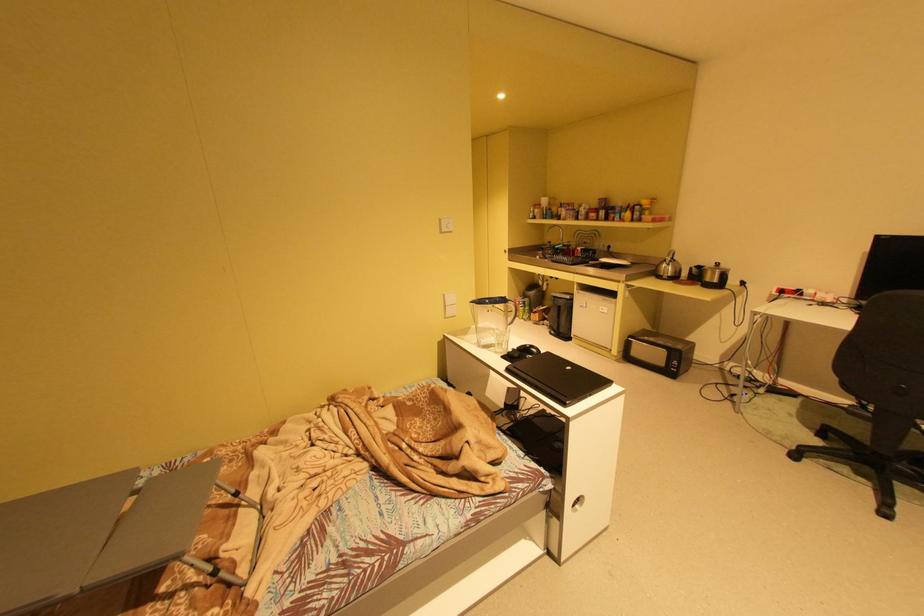
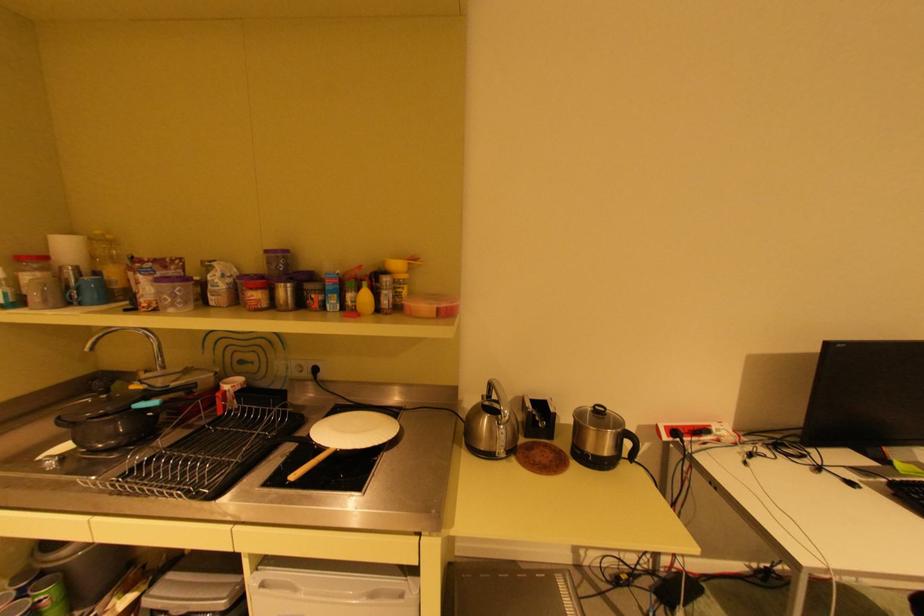
Locate, in the second image, the point that corresponds to [608,199] in the first image.

(274, 251)